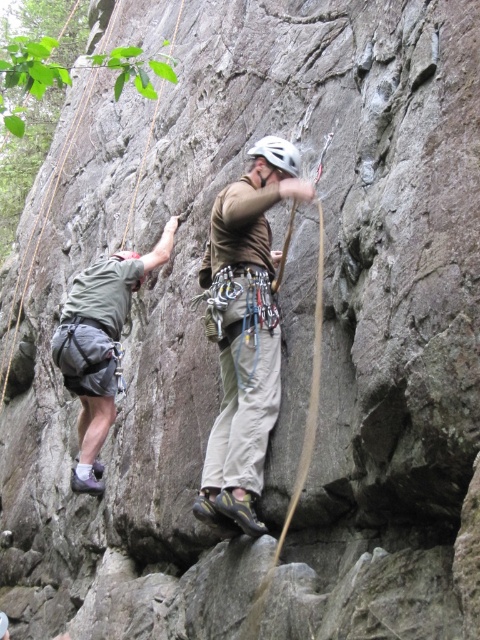
You are a rock climber preparing to ascend the cliff. You have two options for lower body clothing to wear for better mobility and comfort. Which of the following would you choose between the khaki cotton pants at center and the gray fabric shorts at left based on their size?

The khaki cotton pants at center has a smaller size compared to gray fabric shorts at left, so if you prefer a more snug fit for better mobility during climbing, you should choose the khaki cotton pants at center.